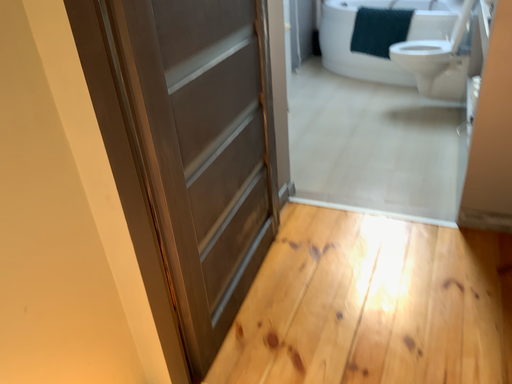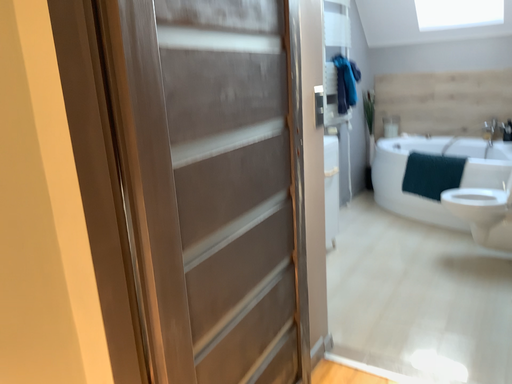
Question: How did the camera likely rotate when shooting the video?

Choices:
 (A) rotated downward
 (B) rotated upward

Answer: (B)